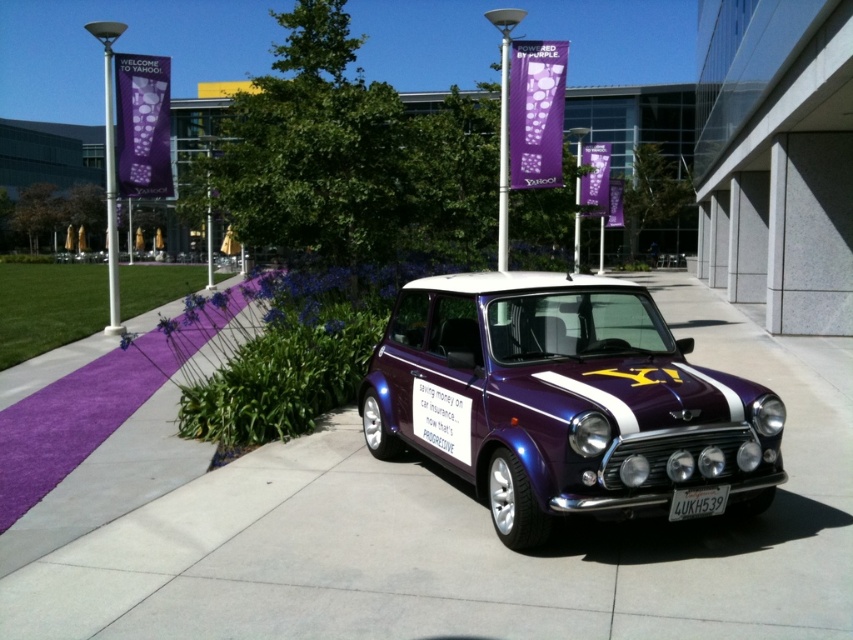
Question: Among these points, which one is farthest from the camera?

Choices:
 (A) (584, 472)
 (B) (683, 502)
 (C) (408, 508)

Answer: (C)

Question: Among these points, which one is nearest to the camera?

Choices:
 (A) (473, 388)
 (B) (469, 598)

Answer: (B)

Question: Where is shiny purple car at center located in relation to white plastic license plate at center in the image?

Choices:
 (A) below
 (B) above

Answer: (B)

Question: Is purple asphalt at center positioned behind white plastic license plate at center?

Choices:
 (A) yes
 (B) no

Answer: (B)

Question: Considering the relative positions of shiny purple car at center and white plastic license plate at center in the image provided, where is shiny purple car at center located with respect to white plastic license plate at center?

Choices:
 (A) right
 (B) left

Answer: (B)

Question: Which point is closer to the camera?

Choices:
 (A) (245, 577)
 (B) (439, 460)

Answer: (A)